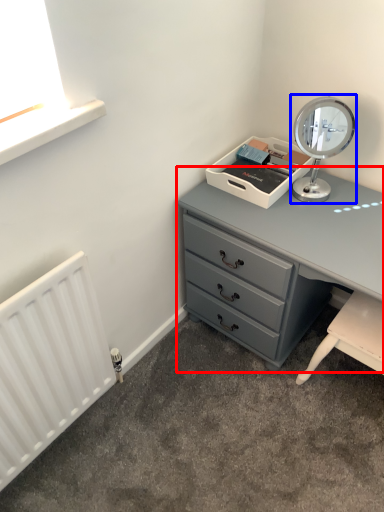
Question: Which object is closer to the camera taking this photo, chest of drawers (highlighted by a red box) or table lamp (highlighted by a blue box)?

Choices:
 (A) chest of drawers
 (B) table lamp

Answer: (A)